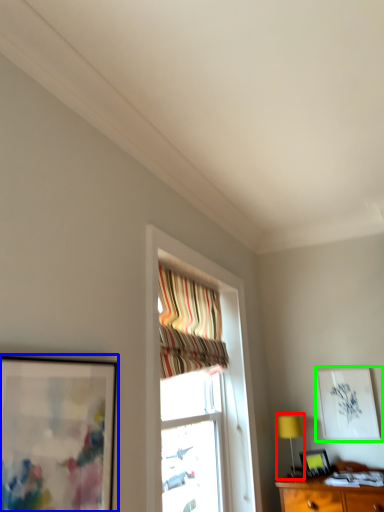
Question: Which object is positioned closest to table lamp (highlighted by a red box)? Select from picture frame (highlighted by a blue box) and picture frame (highlighted by a green box).

Choices:
 (A) picture frame
 (B) picture frame

Answer: (B)